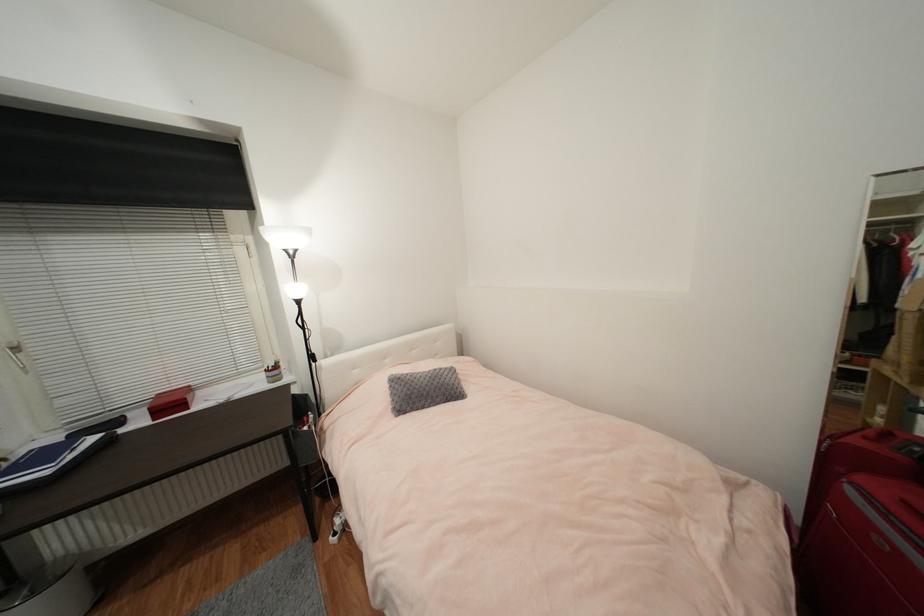
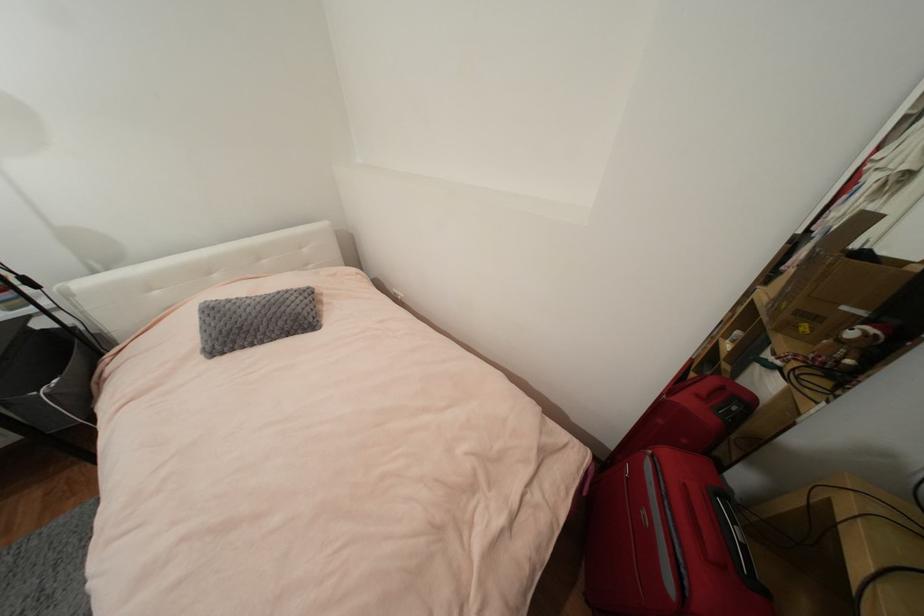
Based on the photo, the images are taken continuously from a first-person perspective. In which direction are you moving?

The movement direction of the cameraman is right, forward.